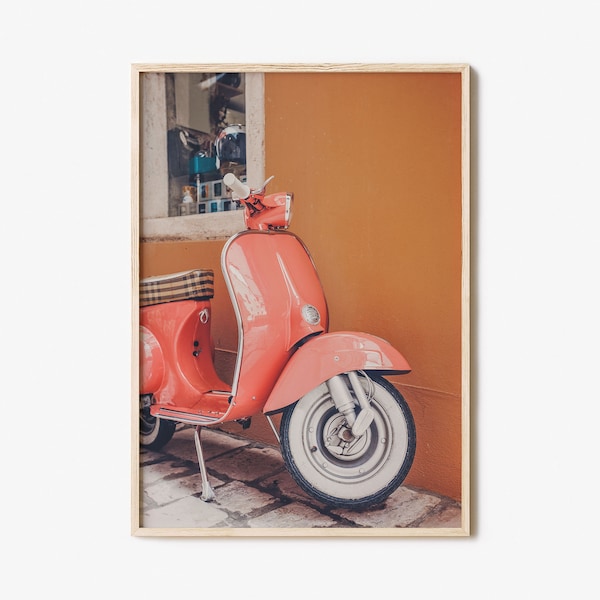
The image size is (600, 600). What are the coordinates of `seat` in the screenshot? It's located at [x=151, y=290].